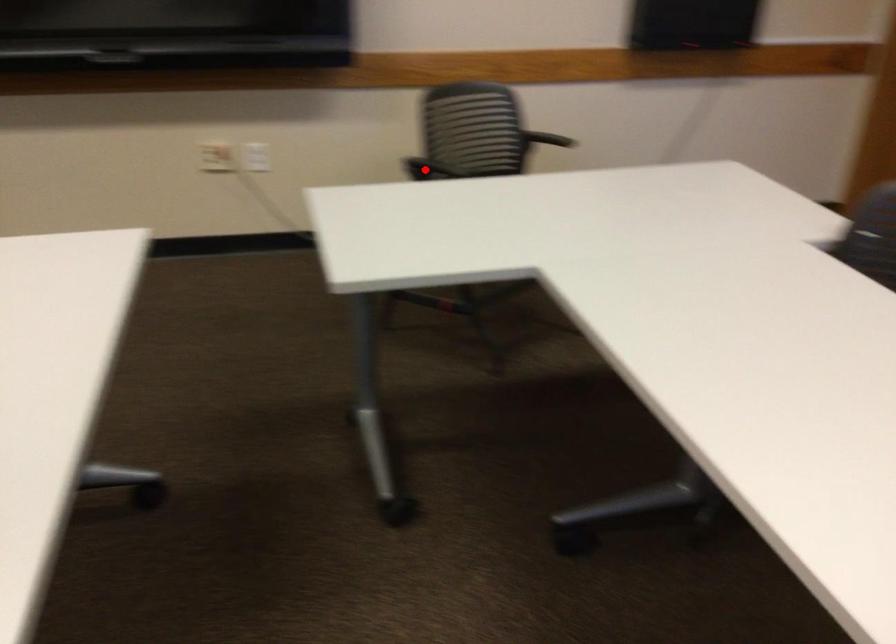
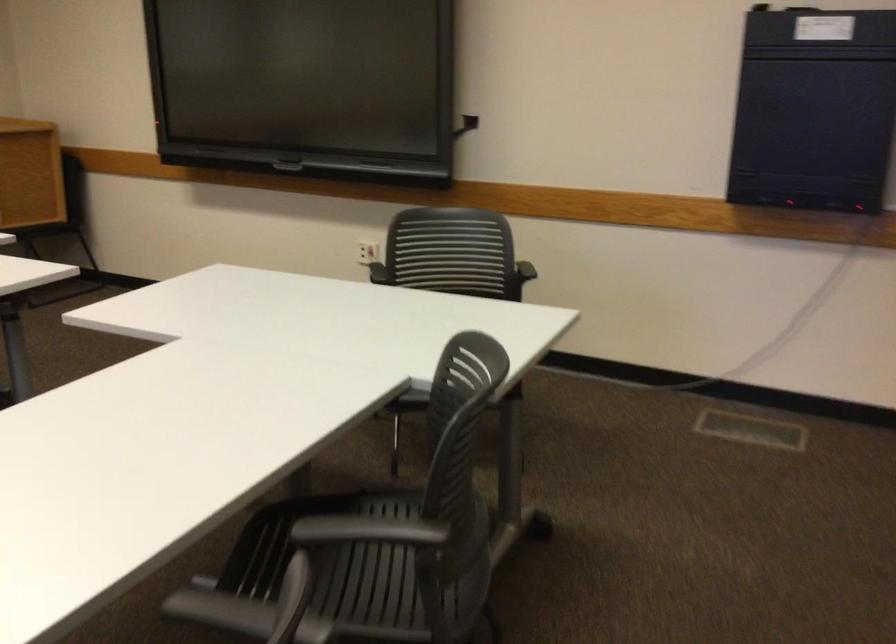
Question: I am providing you with two images of the same scene from different viewpoints. A red point is marked on the first image. Is the red point's position out of view in image 2?

Choices:
 (A) Yes
 (B) No

Answer: (A)